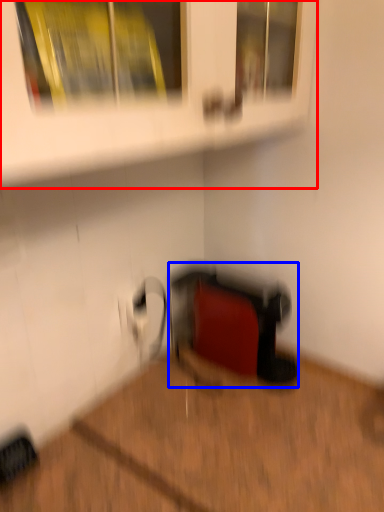
Question: Which of the following is the closest to the observer, shelf (highlighted by a red box) or wide (highlighted by a blue box)?

Choices:
 (A) shelf
 (B) wide

Answer: (A)